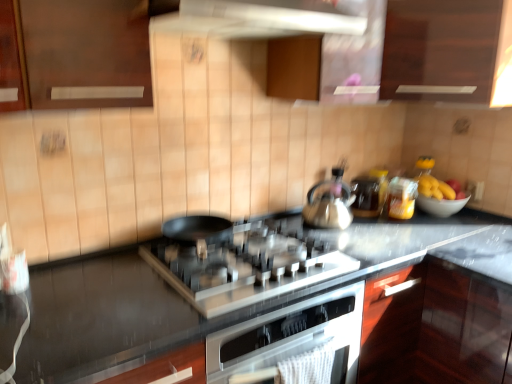
Question: Is matte yellow jar at upper right, the 2th appliance in the left-to-right sequence, to the left or to the right of white glossy exhaust hood at upper center in the image?

Choices:
 (A) left
 (B) right

Answer: (B)

Question: Does point (413, 180) appear closer or farther from the camera than point (286, 31)?

Choices:
 (A) farther
 (B) closer

Answer: (A)

Question: Which object is positioned closest to the satin silver kettle at center?

Choices:
 (A) white glossy exhaust hood at upper center
 (B) matte yellow jar at upper right, the 2th appliance in the left-to-right sequence
 (C) dark wood cabinet at upper center, acting as the first cabinetry starting from the right
 (D) satin silver gas stove at center
 (E) wooden cabinet at upper center, which is counted as the second cabinetry, starting from the right

Answer: (B)

Question: Which of these objects is positioned closest to the white glossy exhaust hood at upper center?

Choices:
 (A) dark wood cabinet at upper center, acting as the first cabinetry starting from the right
 (B) satin silver kettle at center
 (C) wooden cabinet at upper center, which is counted as the second cabinetry, starting from the right
 (D) satin silver gas stove at center
 (E) matte yellow jar at upper right, which is the first appliance in right-to-left order

Answer: (C)